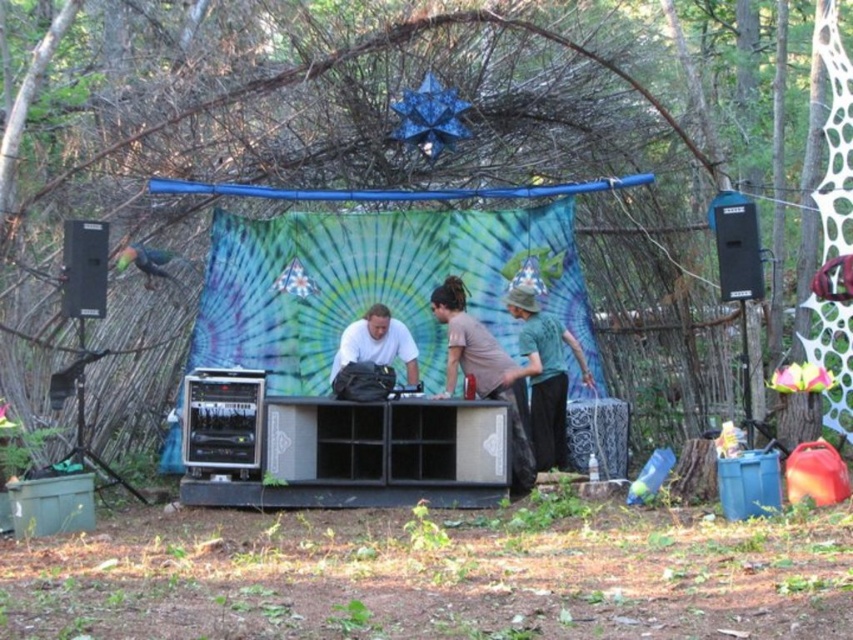
You are organizing a small outdoor concert and need to ensure there is enough space between the two performers. The green cotton shirt at center and the white matte shirt at center are both on stage. Which performer has a wider torso, requiring more space?

The green cotton shirt at center has a larger width than the white matte shirt at center, indicating it requires more space.

You are a photographer positioned in front of the stage. You need to capture a clear photo of both the green cotton shirt at center and the white matte shirt at center. Which shirt should you focus on first to ensure both are in focus?

The green cotton shirt at center is below the white matte shirt at center, so you should focus on the white matte shirt at center first as it is closer to the camera, ensuring both shirts will be in focus when using depth of field appropriately.